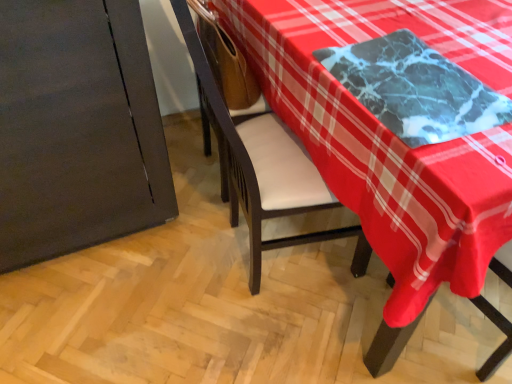
Question: Is marble table at upper right surrounding wooden armchair at center?

Choices:
 (A) no
 (B) yes

Answer: (A)

Question: Is wooden armchair at center at the back of marble table at upper right?

Choices:
 (A) yes
 (B) no

Answer: (B)

Question: From the image's perspective, does marble table at upper right appear higher than wooden armchair at center?

Choices:
 (A) no
 (B) yes

Answer: (A)

Question: Does marble table at upper right have a greater width compared to wooden armchair at center?

Choices:
 (A) yes
 (B) no

Answer: (A)

Question: Is marble table at upper right to the left of wooden armchair at center from the viewer's perspective?

Choices:
 (A) yes
 (B) no

Answer: (B)

Question: Is the depth of marble table at upper right less than that of wooden armchair at center?

Choices:
 (A) yes
 (B) no

Answer: (A)

Question: Is wooden armchair at center oriented towards marble table at upper right?

Choices:
 (A) no
 (B) yes

Answer: (A)

Question: Is wooden armchair at center bigger than marble table at upper right?

Choices:
 (A) no
 (B) yes

Answer: (A)

Question: Is the position of wooden armchair at center less distant than that of marble table at upper right?

Choices:
 (A) yes
 (B) no

Answer: (B)

Question: Is the position of wooden armchair at center more distant than that of marble table at upper right?

Choices:
 (A) no
 (B) yes

Answer: (B)

Question: Would you say marble table at upper right is part of wooden armchair at center's contents?

Choices:
 (A) no
 (B) yes

Answer: (A)

Question: Is wooden armchair at center to the right of marble table at upper right from the viewer's perspective?

Choices:
 (A) no
 (B) yes

Answer: (A)

Question: Is marble table at upper right shorter than marble-like black tray at upper right?

Choices:
 (A) yes
 (B) no

Answer: (B)